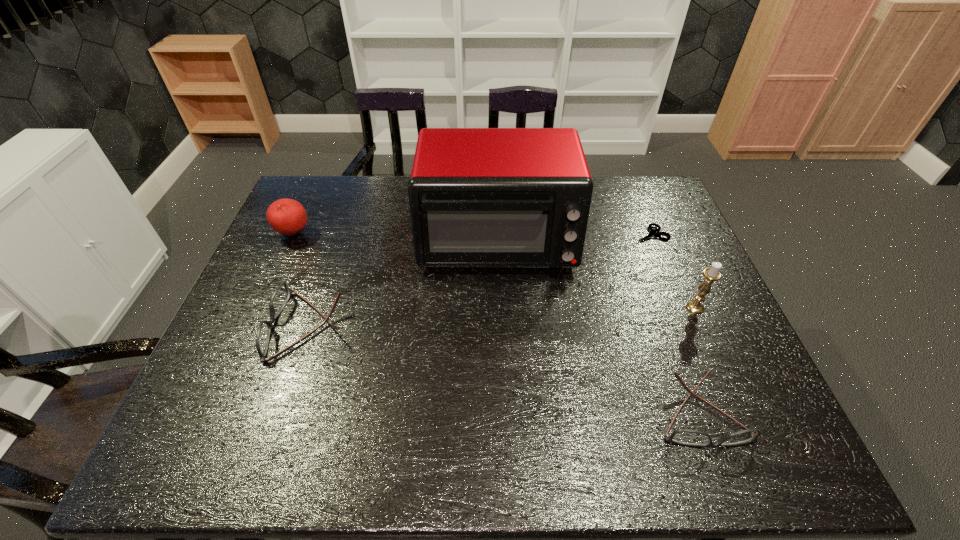
You are a GUI agent. You are given a task and a screenshot of the screen. Output one action in this format:
    pyautogui.click(x=<x>, y=<y>)
    Task: Click on the fourth tallest object
    
    Given the screenshot: What is the action you would take?
    pyautogui.click(x=281, y=295)

Find the location of a particular element. The image size is (960, 540). the left spectacles is located at coordinates (281, 295).

Locate an element on the screen. the fifth tallest object is located at coordinates (688, 437).

Where is `the right spectacles`? the right spectacles is located at coordinates (688, 437).

At what (x,y) coordinates should I click in order to perform the action: click on shears. Please return your answer as a coordinate pair (x, y). Looking at the image, I should click on (652, 232).

This screenshot has width=960, height=540. I want to click on the tallest object, so click(x=479, y=197).

Locate an element on the screen. Image resolution: width=960 pixels, height=540 pixels. the third object from left to right is located at coordinates (479, 197).

Where is `apple`? This screenshot has height=540, width=960. apple is located at coordinates (288, 217).

The image size is (960, 540). Find the location of `candle holder`. candle holder is located at coordinates (711, 274).

The image size is (960, 540). I want to click on free spot located on the front-facing side of the farther spectacles, so click(x=251, y=326).